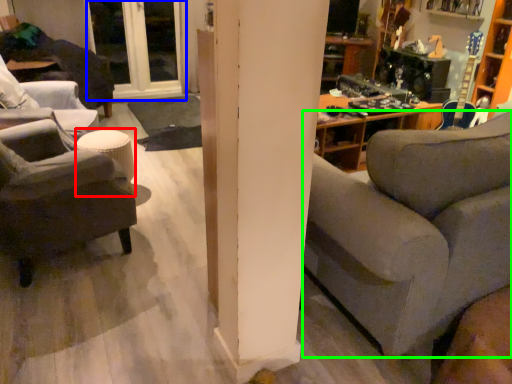
Question: Which object is positioned closest to stool (highlighted by a red box)? Select from window (highlighted by a blue box) and studio couch (highlighted by a green box).

Choices:
 (A) window
 (B) studio couch

Answer: (B)